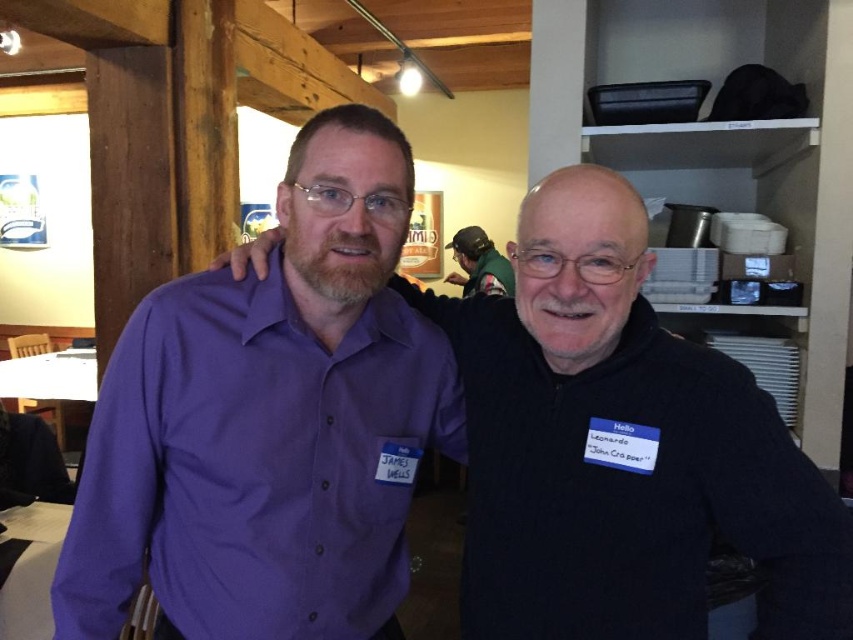
Who is positioned more to the left, purple shirt at center or green fabric shirt at upper center?

From the viewer's perspective, purple shirt at center appears more on the left side.

Consider the image. Is purple shirt at center below green fabric shirt at upper center?

Yes.

Which is in front, point (776, 497) or point (473, 262)?

Point (776, 497) is more forward.

The width and height of the screenshot is (853, 640). I want to click on purple shirt at center, so click(624, 445).

Consider the image. Does purple shirt at center have a lesser height compared to purple smooth shirt at left?

No.

Is purple shirt at center thinner than purple smooth shirt at left?

No.

What do you see at coordinates (624, 445) in the screenshot? This screenshot has height=640, width=853. I see `purple shirt at center` at bounding box center [624, 445].

Where is `purple shirt at center`? purple shirt at center is located at coordinates (624, 445).

Measure the distance between point (144,435) and camera.

Point (144,435) and camera are 37.38 inches apart.

Describe the element at coordinates (254, 465) in the screenshot. I see `purple smooth shirt at left` at that location.

Image resolution: width=853 pixels, height=640 pixels. Find the location of `purple smooth shirt at left`. purple smooth shirt at left is located at coordinates (254, 465).